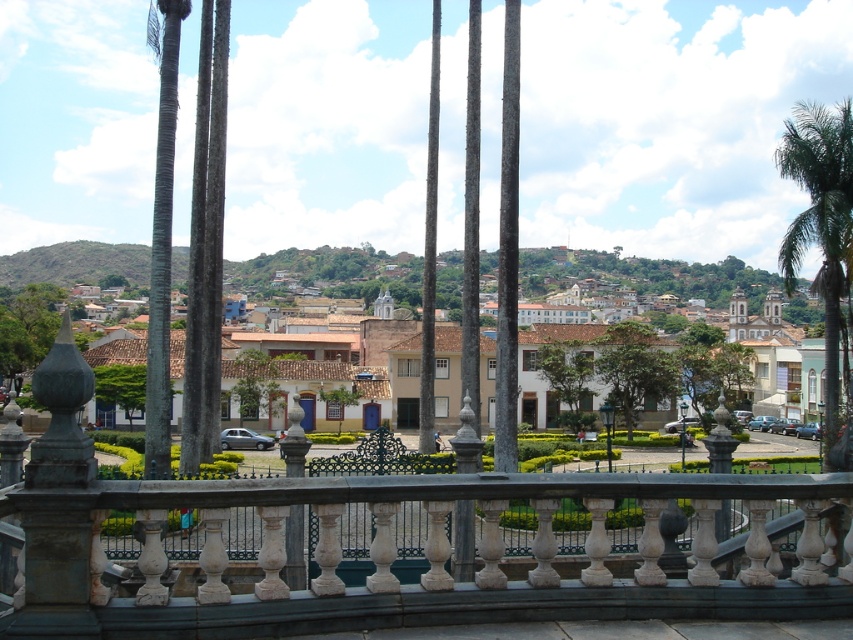
You are an architect designing a new balcony with a view similar to the one in the image. You need to ensure that the white matte building at center and the green leafy palm tree at right are visible from the balcony. Based on their sizes in the image, which object should appear larger in your design to maintain the scene proportion?

The white matte building at center should appear larger in your design since it is bigger than the green leafy palm tree at right in the image.